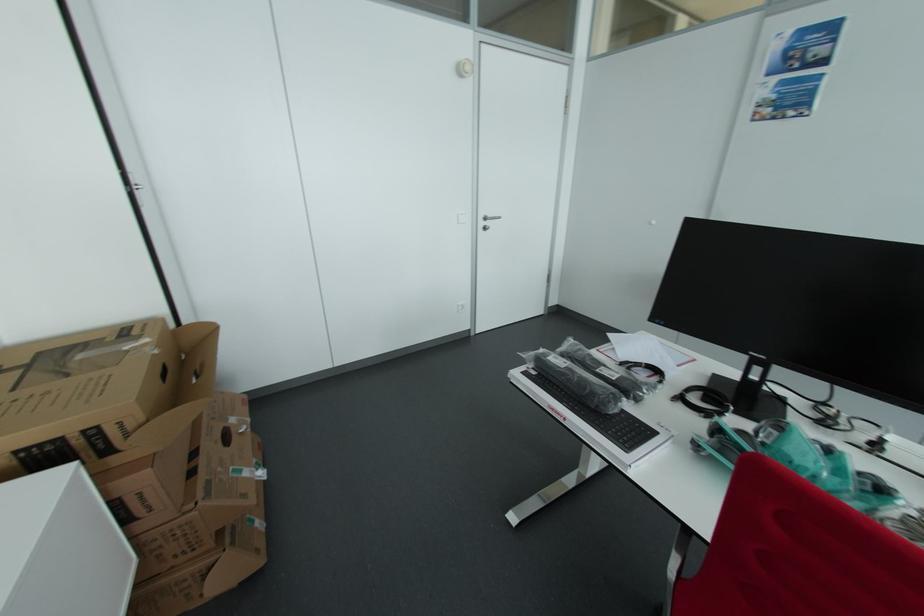
At what (x,y) coordinates should I click in order to perform the action: click on silver door handle. Please return your answer as a coordinate pair (x, y). Looking at the image, I should click on click(x=488, y=221).